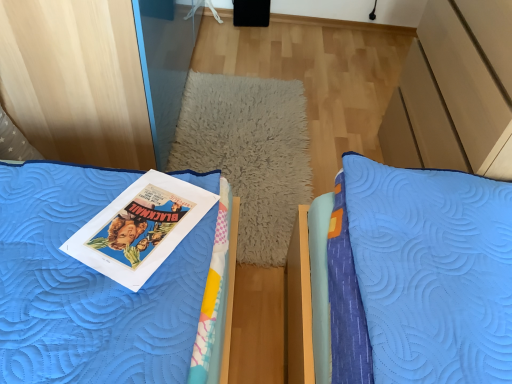
Image resolution: width=512 pixels, height=384 pixels. In order to click on vacant space underneath white fluffy pillow at center (from a real-world perspective) in this screenshot , I will do `click(255, 139)`.